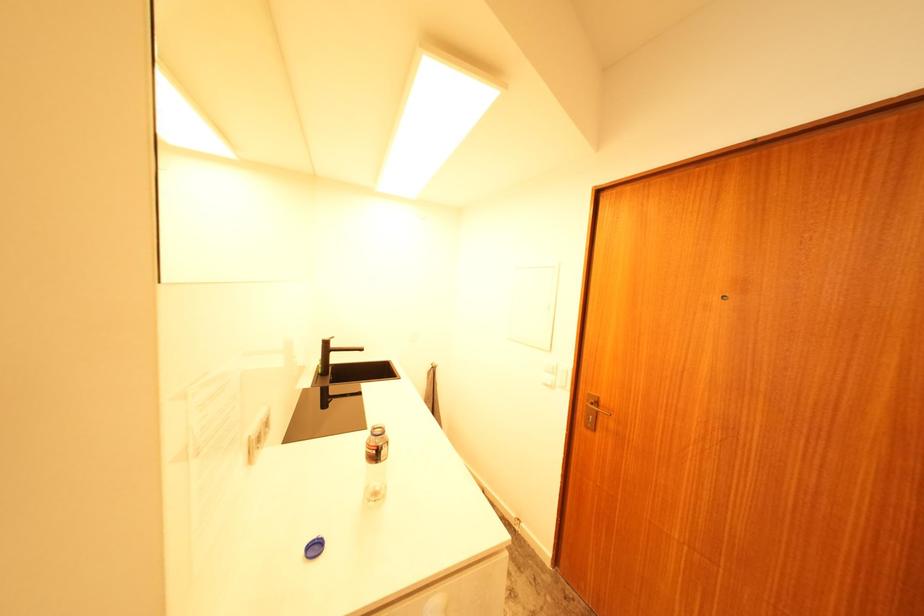
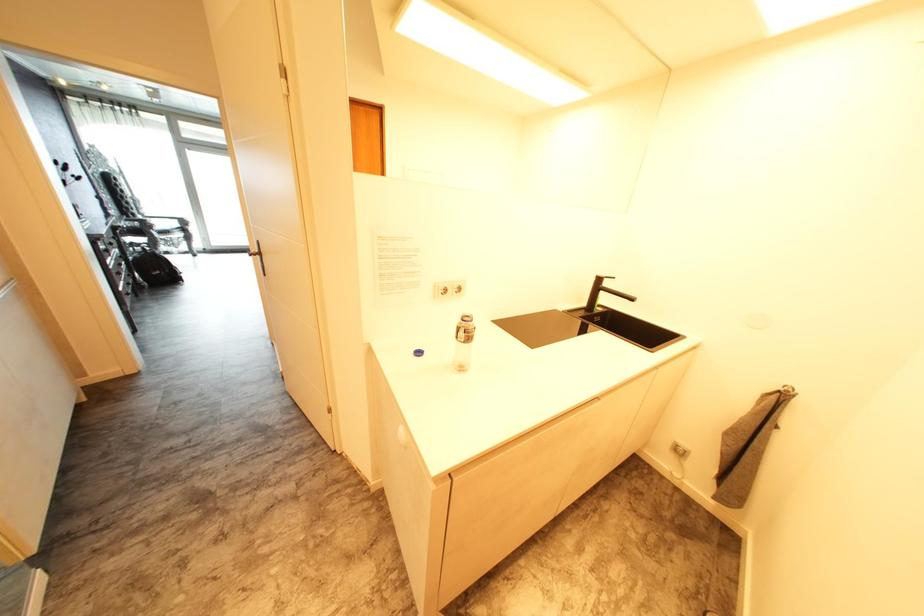
The first image is from the beginning of the video and the second image is from the end. How did the camera likely rotate when shooting the video?

The rotation direction of the camera is left-down.